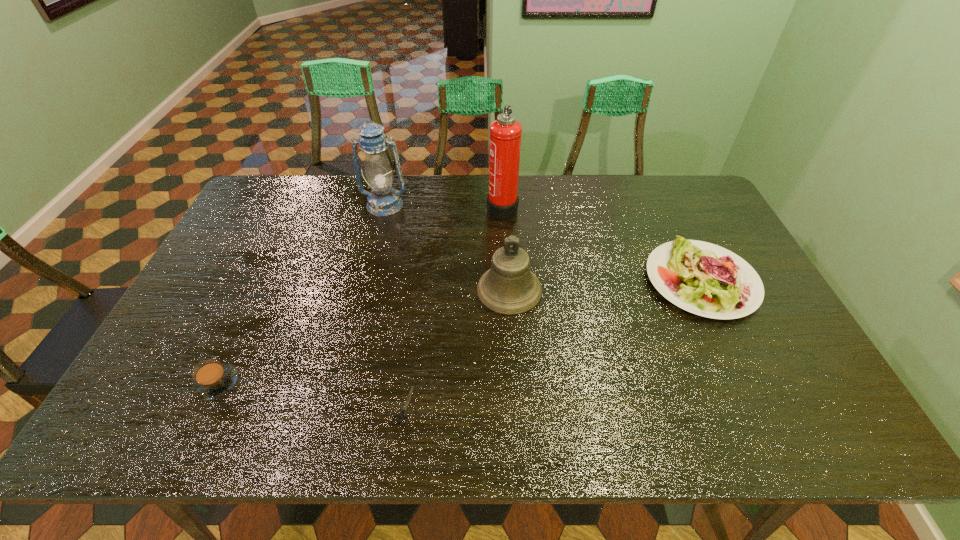
At what (x,y) coordinates should I click in order to perform the action: click on object that is positioned at the near edge. Please return your answer as a coordinate pair (x, y). This screenshot has height=540, width=960. Looking at the image, I should click on (402, 415).

This screenshot has width=960, height=540. Identify the location of object that is at the left edge. (212, 379).

This screenshot has height=540, width=960. I want to click on object present at the right edge, so click(705, 279).

Find the location of a particular element. The image size is (960, 540). vacant space at the far edge of the desktop is located at coordinates (612, 181).

Image resolution: width=960 pixels, height=540 pixels. Find the location of `free space at the near edge of the desktop`. free space at the near edge of the desktop is located at coordinates (478, 428).

In the image, there is a desktop. Where is `free space at the left edge`? free space at the left edge is located at coordinates (196, 345).

Locate an element on the screen. vacant space at the far left corner of the desktop is located at coordinates (297, 176).

What are the coordinates of `unoccupied area between the cappuccino and the salad plate` in the screenshot? It's located at (459, 332).

Where is `empty space that is in between the lantern and the fourth tallest object`? The image size is (960, 540). empty space that is in between the lantern and the fourth tallest object is located at coordinates (543, 243).

You are a GUI agent. You are given a task and a screenshot of the screen. Output one action in this format:
    pyautogui.click(x=<x>, y=<y>)
    Task: Click on the vacant area that lies between the shortest object and the second object from left to right
    This screenshot has height=540, width=960.
    Given the screenshot: What is the action you would take?
    pyautogui.click(x=394, y=306)